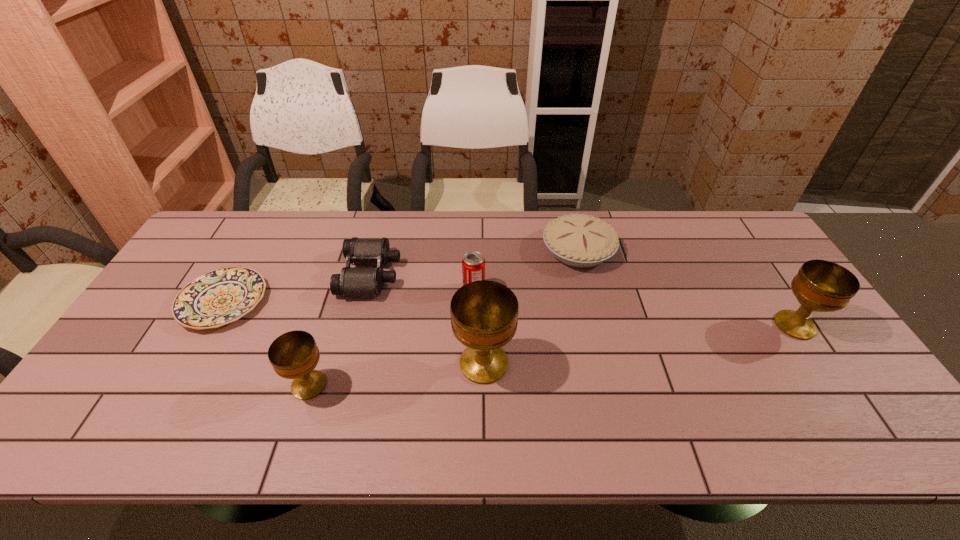
You are a GUI agent. You are given a task and a screenshot of the screen. Output one action in this format:
    pyautogui.click(x=<x>, y=<y>)
    Task: Click on the soda can
    This screenshot has height=540, width=960.
    Given the screenshot: What is the action you would take?
    pyautogui.click(x=473, y=263)

Identify the location of free region located on the left of the shortest chalice. (268, 385).

At what (x,y) coordinates should I click in order to perform the action: click on vacant point located 0.210m on the left of the tallest object. Please return your answer as a coordinate pair (x, y). Looking at the image, I should click on (372, 363).

Identify the location of vacant space located 0.090m on the back of the rightmost object. (768, 286).

Where is `blank space located on the right of the shortest object`? blank space located on the right of the shortest object is located at coordinates (363, 301).

Locate an element on the screen. free spot located through the eyepieces of the binoculars is located at coordinates (467, 274).

What are the coordinates of `blank area located on the left of the pie` in the screenshot? It's located at (492, 250).

Find the location of a particular element. This screenshot has height=540, width=960. free space located on the right of the soda can is located at coordinates (586, 289).

The height and width of the screenshot is (540, 960). What are the coordinates of `binoculars located in the far edge section of the desktop` in the screenshot? It's located at (352, 281).

The height and width of the screenshot is (540, 960). Find the location of `pie positioned at the far edge`. pie positioned at the far edge is located at coordinates (582, 241).